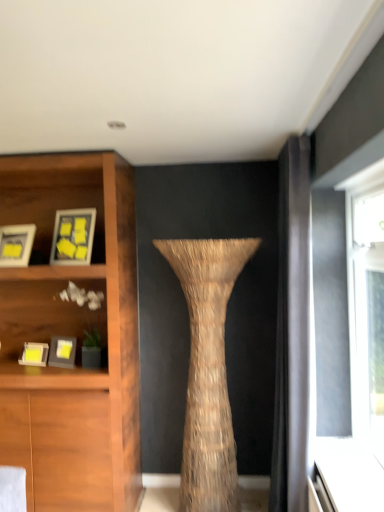
Question: Is braided straw vase at center facing towards matte black picture frame at left, the 3th picture frame viewed from the top?

Choices:
 (A) no
 (B) yes

Answer: (A)

Question: From a real-world perspective, is braided straw vase at center positioned under matte black picture frame at left, the 3th picture frame viewed from the top, based on gravity?

Choices:
 (A) no
 (B) yes

Answer: (B)

Question: Is braided straw vase at center at the left side of matte black picture frame at left, the 2th picture frame from the bottom?

Choices:
 (A) yes
 (B) no

Answer: (B)

Question: From the image's perspective, is braided straw vase at center on matte black picture frame at left, the 3th picture frame viewed from the top?

Choices:
 (A) no
 (B) yes

Answer: (A)

Question: Is braided straw vase at center further to camera compared to matte black picture frame at left, the 3th picture frame viewed from the top?

Choices:
 (A) yes
 (B) no

Answer: (B)

Question: Considering the relative sizes of braided straw vase at center and matte black picture frame at left, the 3th picture frame viewed from the top, in the image provided, is braided straw vase at center shorter than matte black picture frame at left, the 3th picture frame viewed from the top,?

Choices:
 (A) yes
 (B) no

Answer: (B)

Question: From a real-world perspective, is braided straw vase at center positioned over matte black picture frame at upper left, which ranks as the 2th picture frame in top-to-bottom order, based on gravity?

Choices:
 (A) yes
 (B) no

Answer: (B)

Question: Is braided straw vase at center at the right side of matte black picture frame at upper left, which is the 3th picture frame from bottom to top?

Choices:
 (A) no
 (B) yes

Answer: (B)

Question: Does braided straw vase at center have a smaller size compared to matte black picture frame at upper left, which is the 3th picture frame from bottom to top?

Choices:
 (A) no
 (B) yes

Answer: (A)

Question: Considering the relative positions of braided straw vase at center and matte black picture frame at upper left, which ranks as the 2th picture frame in top-to-bottom order, in the image provided, is braided straw vase at center in front of matte black picture frame at upper left, which ranks as the 2th picture frame in top-to-bottom order,?

Choices:
 (A) yes
 (B) no

Answer: (A)

Question: Can you confirm if braided straw vase at center is positioned to the left of matte black picture frame at upper left, which ranks as the 2th picture frame in top-to-bottom order?

Choices:
 (A) no
 (B) yes

Answer: (A)

Question: Considering the relative sizes of braided straw vase at center and matte black picture frame at upper left, which ranks as the 2th picture frame in top-to-bottom order, in the image provided, is braided straw vase at center wider than matte black picture frame at upper left, which ranks as the 2th picture frame in top-to-bottom order,?

Choices:
 (A) no
 (B) yes

Answer: (B)

Question: Is matte black picture frame at left, the 3th picture frame viewed from the top, not inside braided straw vase at center?

Choices:
 (A) no
 (B) yes

Answer: (B)